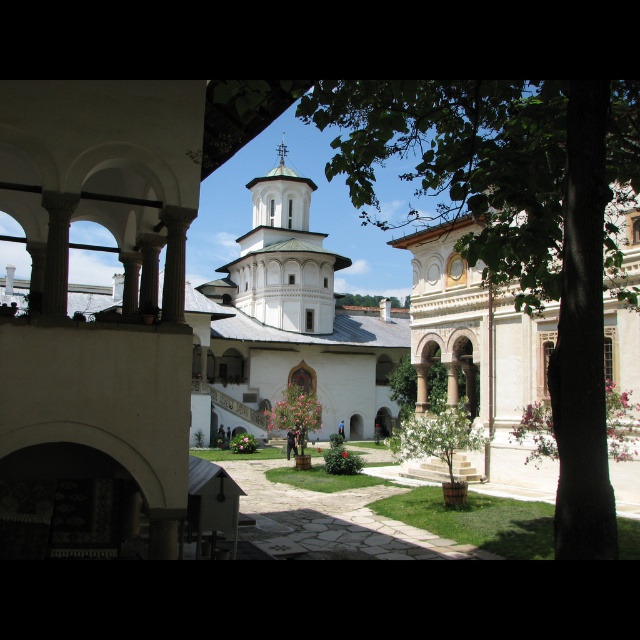
Is green leafy tree at center smaller than white smooth tower at center?

No.

Consider the image. Which of these two, green leafy tree at center or white smooth tower at center, stands shorter?

Standing shorter between the two is white smooth tower at center.

Does point (394, 97) come closer to viewer compared to point (275, 264)?

Yes, it is.

Find the location of a particular element. Image resolution: width=640 pixels, height=640 pixels. green leafy tree at center is located at coordinates (516, 225).